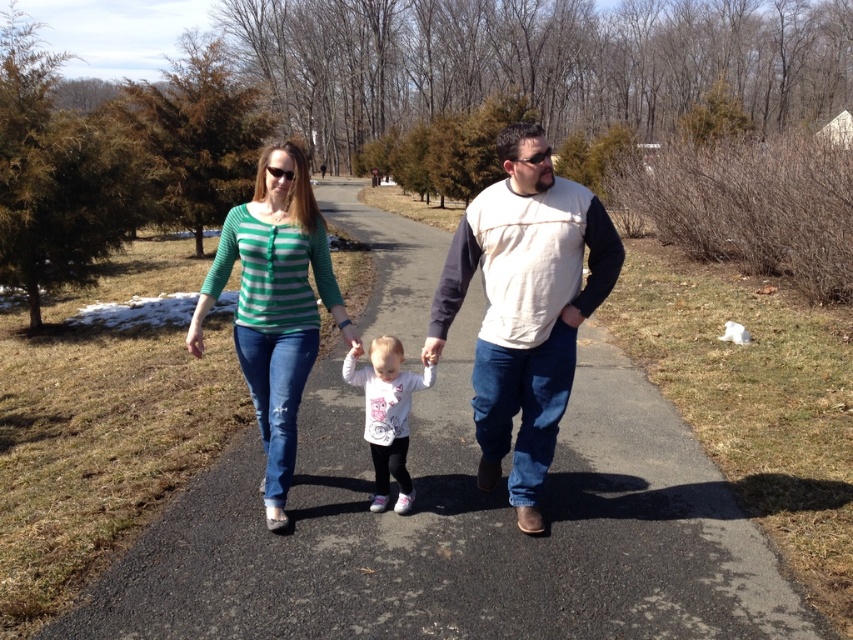
Between point (289, 237) and point (405, 381), which one is positioned behind?

The point (405, 381) is more distant.

Does green striped shirt at center appear on the right side of white matte shirt at center?

In fact, green striped shirt at center is to the left of white matte shirt at center.

Does point (273, 230) come farther from viewer compared to point (392, 465)?

That is False.

This screenshot has width=853, height=640. I want to click on green striped shirt at center, so click(x=276, y=305).

Does point (601, 532) lie behind point (508, 140)?

Yes, point (601, 532) is behind point (508, 140).

Between asphalt at center and light beige sweater at center, which one appears on the right side from the viewer's perspective?

From the viewer's perspective, light beige sweater at center appears more on the right side.

What are the coordinates of `asphalt at center` in the screenshot? It's located at (459, 531).

Consider the image. Does light beige sweater at center appear on the right side of green striped shirt at center?

Indeed, light beige sweater at center is positioned on the right side of green striped shirt at center.

Does light beige sweater at center have a lesser height compared to green striped shirt at center?

No.

Which is in front, point (506, 356) or point (265, 497)?

Positioned in front is point (506, 356).

This screenshot has height=640, width=853. In order to click on light beige sweater at center in this screenshot , I will do `click(524, 307)`.